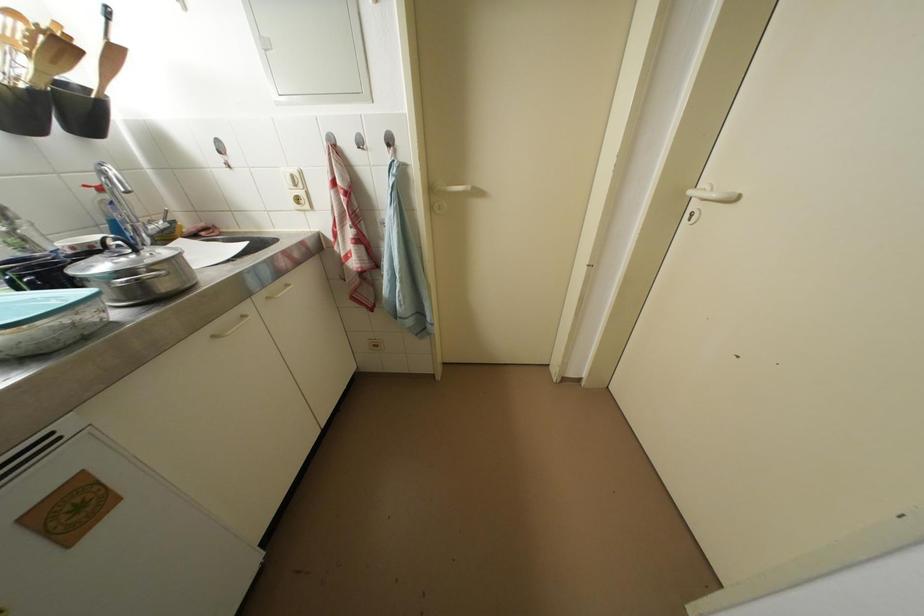
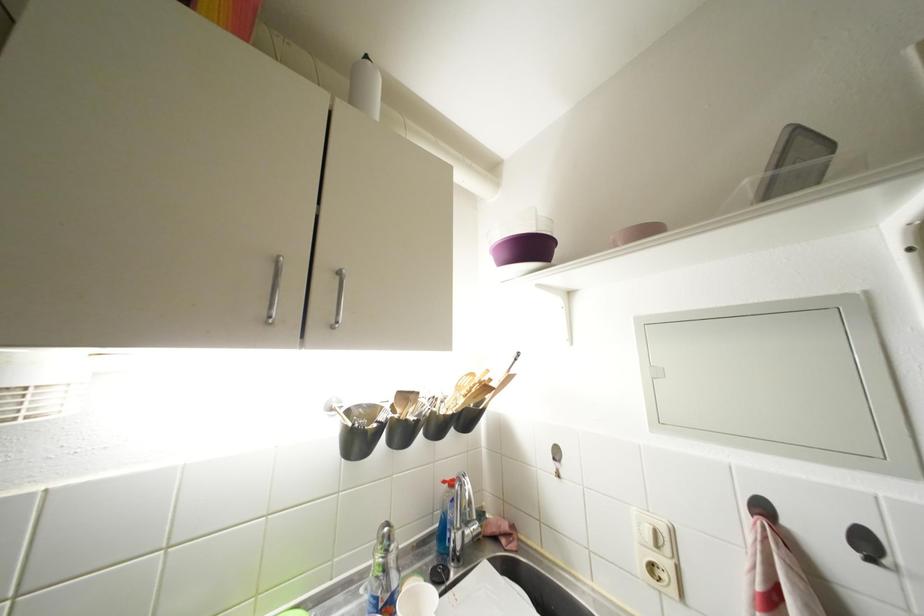
The point at (107,193) is marked in the first image. Where is the corresponding point in the second image?

(457, 488)